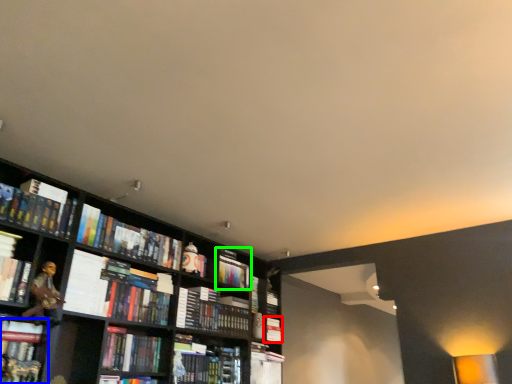
Question: Which object is the closest to the book (highlighted by a red box)? Choose among these: book (highlighted by a blue box) or book (highlighted by a green box).

Choices:
 (A) book
 (B) book

Answer: (B)